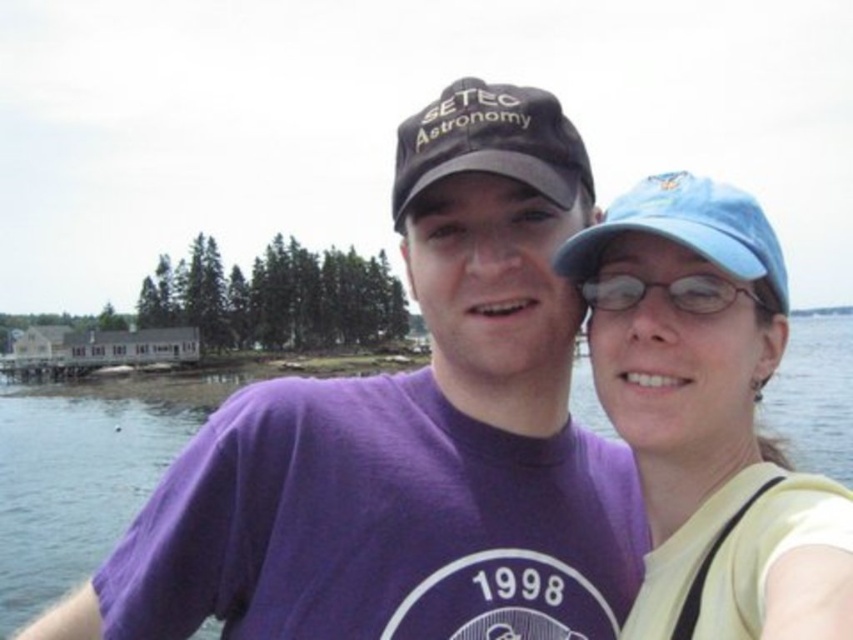
Can you confirm if transparent water at center is positioned to the left of blue fabric baseball cap at right?

In fact, transparent water at center is to the right of blue fabric baseball cap at right.

Which is in front, point (25, 509) or point (631, 195)?

Positioned in front is point (631, 195).

Where is `transparent water at center`? transparent water at center is located at coordinates (73, 486).

Is blue fabric baseball cap at right shorter than clear plastic glasses at upper center?

No.

Describe the element at coordinates (686, 228) in the screenshot. I see `blue fabric baseball cap at right` at that location.

The height and width of the screenshot is (640, 853). What do you see at coordinates (686, 228) in the screenshot?
I see `blue fabric baseball cap at right` at bounding box center [686, 228].

The height and width of the screenshot is (640, 853). What are the coordinates of `blue fabric baseball cap at right` in the screenshot? It's located at (686, 228).

Who is positioned more to the left, matte blue cap at upper right or blue fabric baseball cap at right?

Positioned to the left is matte blue cap at upper right.

Who is lower down, matte blue cap at upper right or blue fabric baseball cap at right?

matte blue cap at upper right is below.

Measure the distance between point (x=608, y=355) and camera.

The distance of point (x=608, y=355) from camera is 15.38 meters.

Find the location of a particular element. This screenshot has width=853, height=640. matte blue cap at upper right is located at coordinates (706, 412).